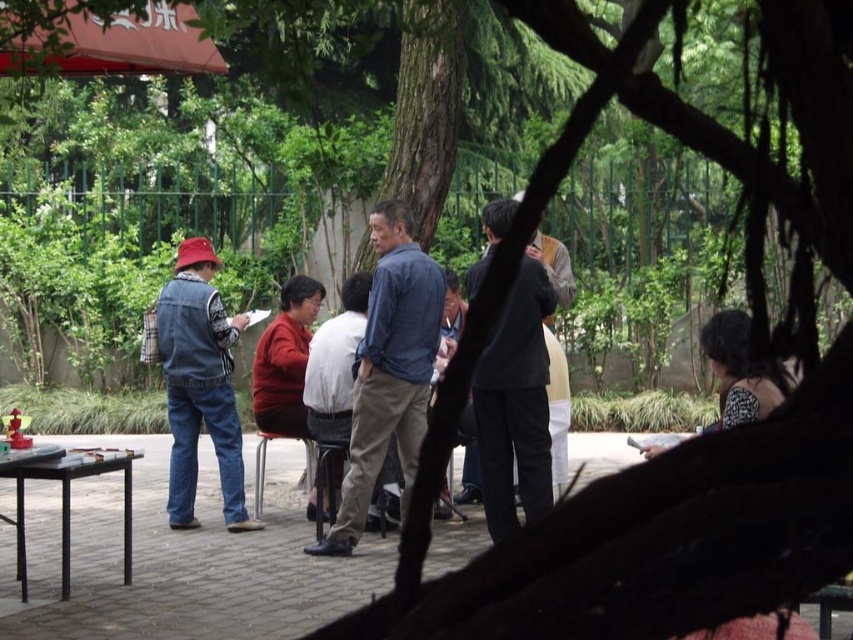
Between dark gray suit at center and denim jacket at center, which one has less height?

Standing shorter between the two is denim jacket at center.

Can you confirm if dark gray suit at center is positioned below denim jacket at center?

No, dark gray suit at center is not below denim jacket at center.

Identify the location of dark gray suit at center. This screenshot has width=853, height=640. (515, 404).

At what (x,y) coordinates should I click in order to perform the action: click on dark gray suit at center. Please return your answer as a coordinate pair (x, y). This screenshot has height=640, width=853. Looking at the image, I should click on (515, 404).

Looking at this image, does blue denim shirt at center have a lesser height compared to denim jacket at center?

In fact, blue denim shirt at center may be taller than denim jacket at center.

Between point (418, 449) and point (312, 412), which one is positioned in front?

Point (418, 449)

Where is `blue denim shirt at center`? This screenshot has height=640, width=853. blue denim shirt at center is located at coordinates (389, 371).

Does blue denim shirt at center appear over metallic black picnic table at lower left?

Yes.

Can you confirm if blue denim shirt at center is smaller than metallic black picnic table at lower left?

No.

Is point (416, 321) positioned after point (62, 588)?

That is True.

This screenshot has width=853, height=640. In order to click on blue denim shirt at center in this screenshot , I will do `click(389, 371)`.